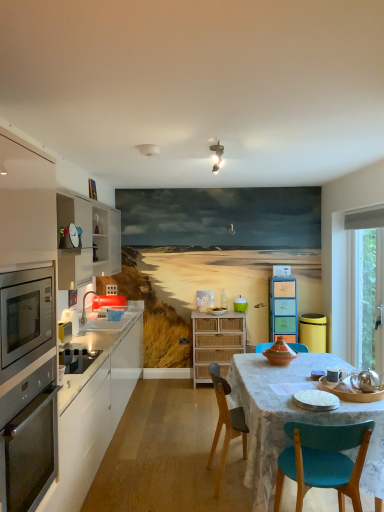
Locate an element on the screen. This screenshot has height=512, width=384. free point above teal plastic container at center (from a real-world perspective) is located at coordinates (238, 295).